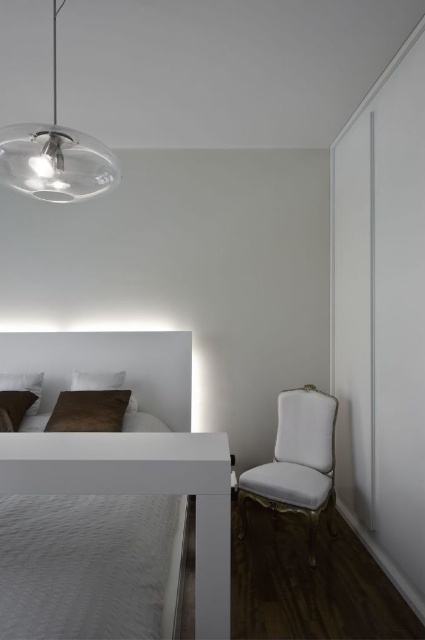
You are trying to place a small decorative item between the velvet brown pillow at lower left and the white soft pillow at lower left on the bed. Can you fit it there if the item is 6 inches wide?

The velvet brown pillow at lower left and white soft pillow at lower left are 5.78 inches apart. Since the decorative item is 6 inches wide, it is slightly wider than the space between them. Therefore, it won

You are organizing the pillows on the bed and want to place a new decorative pillow between the velvet brown pillow at lower left and the white soft pillow at upper left. Based on their current positions, where should you position the new pillow to maintain the existing arrangement?

You should place the new decorative pillow between the velvet brown pillow at lower left and the white soft pillow at upper left so that it is positioned in front of the white soft pillow at upper left, maintaining the spatial relationship where the velvet brown pillow at lower left is already in front.